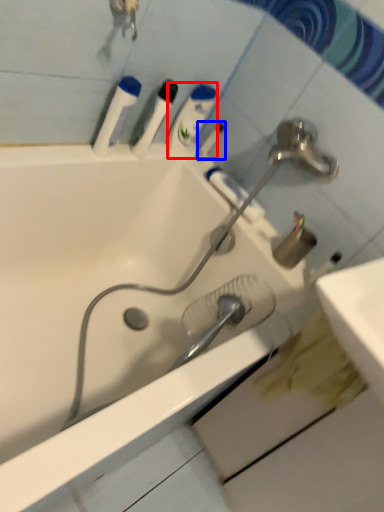
Question: Which object appears closest to the camera in this image, mouthwash (highlighted by a red box) or toothbrush (highlighted by a blue box)?

Choices:
 (A) mouthwash
 (B) toothbrush

Answer: (A)